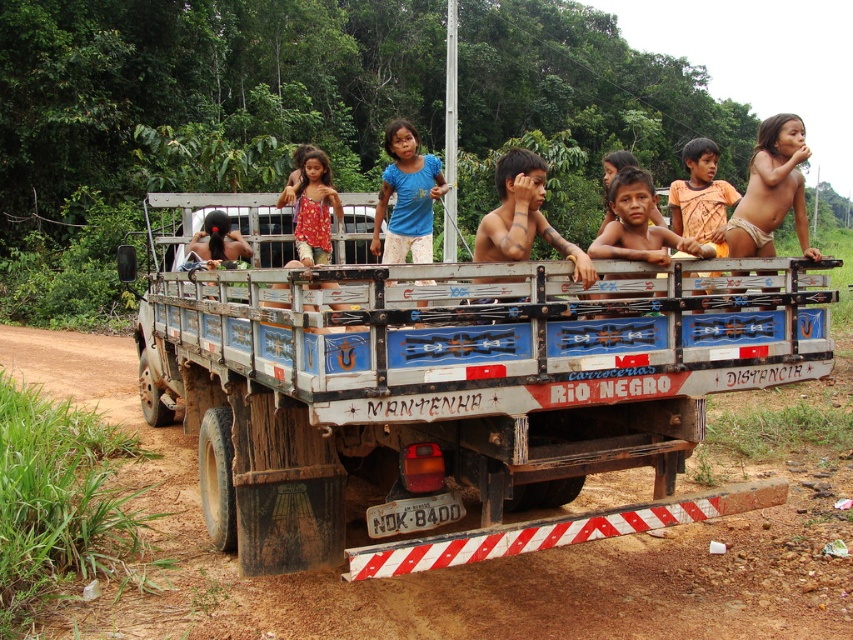
You are a photographer taking a picture of the brown wooden truck at center and the blue cotton shirt at center. Which object will appear closer to the camera in the photo?

The brown wooden truck at center will appear closer to the camera because the blue cotton shirt at center is behind it.

You are a photographer taking a picture of the brown wooden truck at center and the blue cotton shirt at center. Which object will appear shorter in the photo?

The brown wooden truck at center will appear shorter in the photo because it has a lesser height compared to the blue cotton shirt at center.

You are standing in front of the truck and want to know which of the two points, point (512, 161) or point (300, 234), is nearer to you. Can you determine this based on their positions?

Point (512, 161) is closer to the camera than point (300, 234), so it is nearer to you.